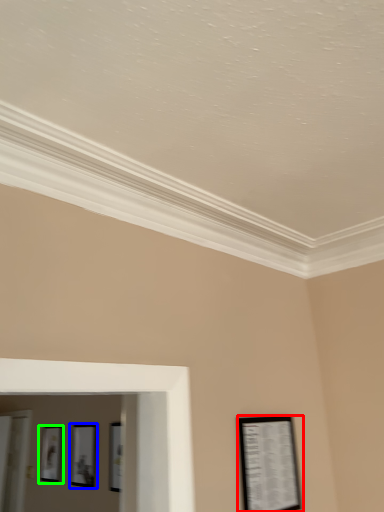
Question: Estimate the real-world distances between objects in this image. Which object is closer to picture frame (highlighted by a red box), picture frame (highlighted by a blue box) or picture frame (highlighted by a green box)?

Choices:
 (A) picture frame
 (B) picture frame

Answer: (A)